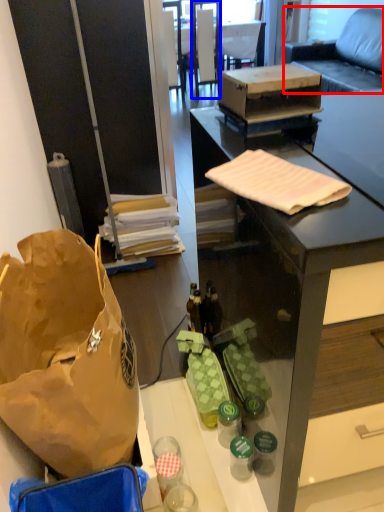
Question: Which of the following is the closest to the observer, studio couch (highlighted by a red box) or chair (highlighted by a blue box)?

Choices:
 (A) studio couch
 (B) chair

Answer: (A)